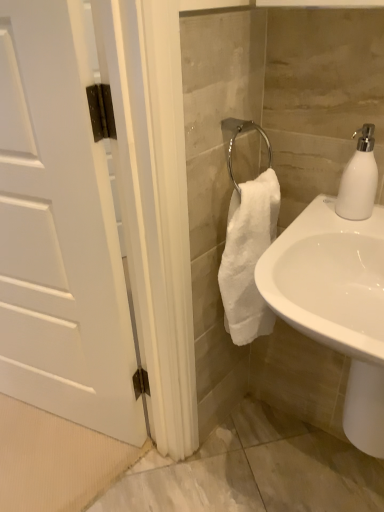
Question: Is white glossy sink at lower right at the back of white matte soap dispenser at upper right?

Choices:
 (A) yes
 (B) no

Answer: (B)

Question: Is white matte soap dispenser at upper right located outside white glossy sink at lower right?

Choices:
 (A) yes
 (B) no

Answer: (A)

Question: Is white matte soap dispenser at upper right at the right side of white glossy sink at lower right?

Choices:
 (A) no
 (B) yes

Answer: (B)

Question: Is white matte soap dispenser at upper right far away from white glossy sink at lower right?

Choices:
 (A) yes
 (B) no

Answer: (B)

Question: Can you confirm if white matte soap dispenser at upper right is positioned to the left of white glossy sink at lower right?

Choices:
 (A) no
 (B) yes

Answer: (A)

Question: Considering the relative positions of white matte soap dispenser at upper right and white glossy sink at lower right in the image provided, is white matte soap dispenser at upper right to the left or to the right of white glossy sink at lower right?

Choices:
 (A) left
 (B) right

Answer: (B)

Question: In terms of width, does white matte soap dispenser at upper right look wider or thinner when compared to white glossy sink at lower right?

Choices:
 (A) wide
 (B) thin

Answer: (B)

Question: From their relative heights in the image, would you say white matte soap dispenser at upper right is taller or shorter than white glossy sink at lower right?

Choices:
 (A) short
 (B) tall

Answer: (A)

Question: From a real-world perspective, relative to white glossy sink at lower right, is white matte soap dispenser at upper right vertically above or below?

Choices:
 (A) above
 (B) below

Answer: (A)

Question: Which is correct: white glossy sink at lower right is inside white matte soap dispenser at upper right, or outside of it?

Choices:
 (A) outside
 (B) inside

Answer: (A)

Question: Is white glossy sink at lower right wider or thinner than white matte soap dispenser at upper right?

Choices:
 (A) thin
 (B) wide

Answer: (B)

Question: From the image's perspective, is white glossy sink at lower right above or below white matte soap dispenser at upper right?

Choices:
 (A) above
 (B) below

Answer: (B)

Question: Relative to white matte soap dispenser at upper right, is white glossy sink at lower right in front or behind?

Choices:
 (A) behind
 (B) front

Answer: (B)

Question: Considering the positions of white glossy sink at lower right and white matte door at left in the image, is white glossy sink at lower right taller or shorter than white matte door at left?

Choices:
 (A) short
 (B) tall

Answer: (A)

Question: Is point (377, 357) closer or farther from the camera than point (23, 53)?

Choices:
 (A) farther
 (B) closer

Answer: (B)